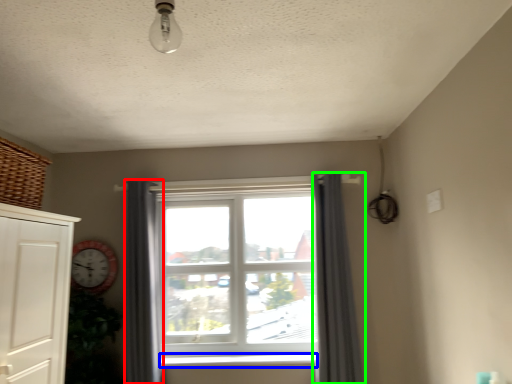
Question: Estimate the real-world distances between objects in this image. Which object is farther from curtain (highlighted by a red box), window sill (highlighted by a blue box) or curtain (highlighted by a green box)?

Choices:
 (A) window sill
 (B) curtain

Answer: (B)